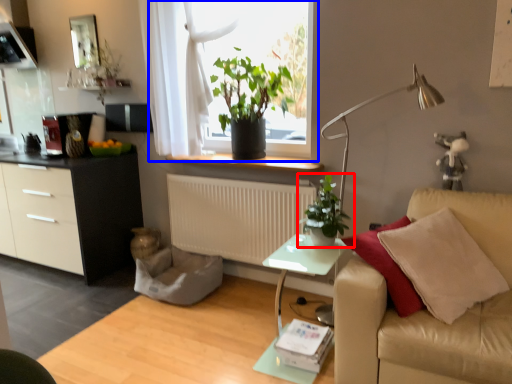
Question: Which of the following is the closest to the observer, houseplant (highlighted by a red box) or window (highlighted by a blue box)?

Choices:
 (A) houseplant
 (B) window

Answer: (A)